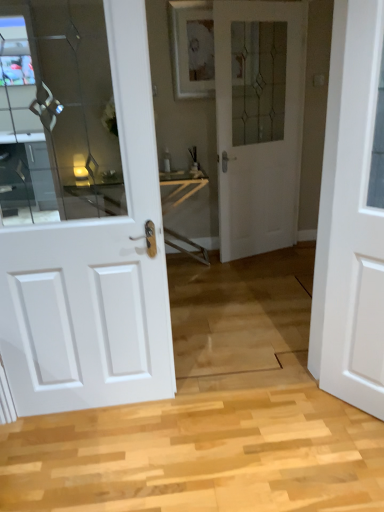
Find the location of `free space above white glass door at center, the second door in the right-to-left sequence (from a real-world perspective)`. free space above white glass door at center, the second door in the right-to-left sequence (from a real-world perspective) is located at coordinates (271, 4).